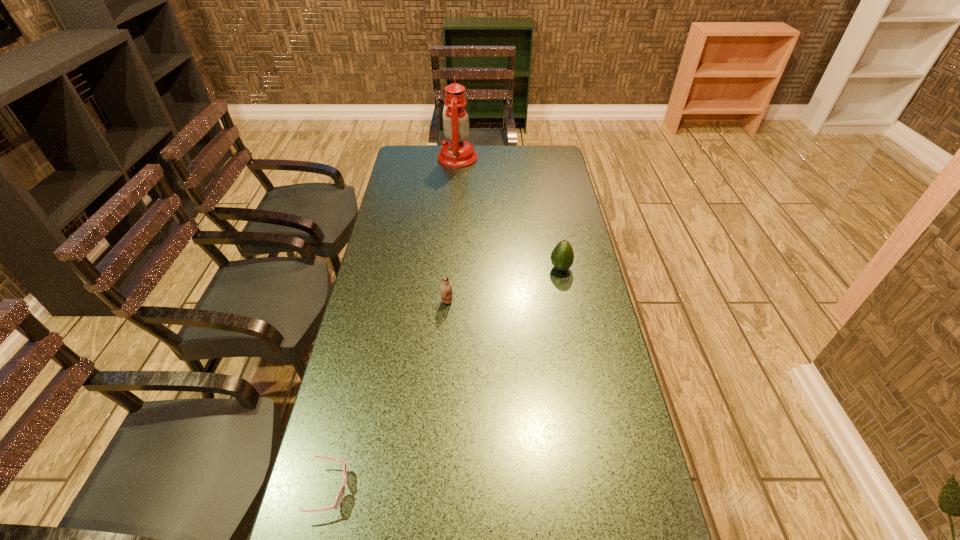
This screenshot has height=540, width=960. In order to click on the farthest object in this screenshot , I will do `click(457, 152)`.

Where is `the tallest object`? Image resolution: width=960 pixels, height=540 pixels. the tallest object is located at coordinates click(x=457, y=152).

The image size is (960, 540). What are the coordinates of `the second farthest object` in the screenshot? It's located at (562, 257).

You are a GUI agent. You are given a task and a screenshot of the screen. Output one action in this format:
    pyautogui.click(x=<x>, y=<y>)
    Task: Click on the rightmost object
    
    Given the screenshot: What is the action you would take?
    click(562, 257)

I want to click on chocolate milk, so click(x=446, y=288).

You are a GUI agent. You are given a task and a screenshot of the screen. Output one action in this format:
    pyautogui.click(x=<x>, y=<y>)
    Task: Click on the nearest object
    This screenshot has width=960, height=540.
    Given the screenshot: What is the action you would take?
    pos(339,498)

This screenshot has height=540, width=960. Find the location of `sunglasses`. sunglasses is located at coordinates (339, 498).

Locate an element on the screen. The image size is (960, 540). vacant space located on the front of the oil lamp is located at coordinates (454, 206).

Identify the location of free space located 0.230m on the front of the second farthest object. The image size is (960, 540). (572, 328).

Find the location of `vacant space located on the front of the chocolate milk`. vacant space located on the front of the chocolate milk is located at coordinates (445, 322).